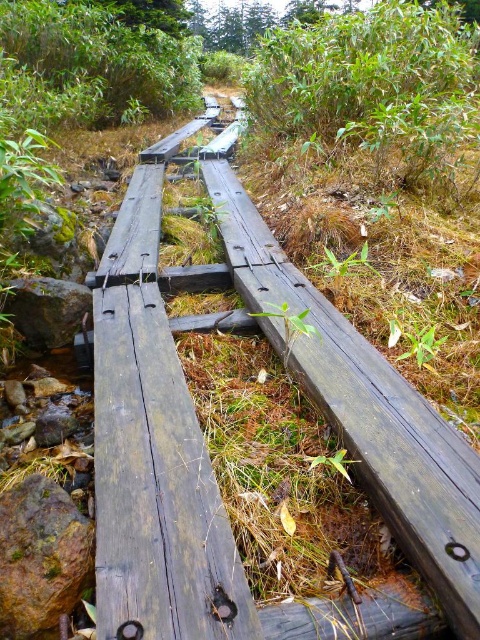
You are standing on the rustic wooden bridge and want to reach both the point at coordinates point (267, 332) and point (56, 484). Which point is closer to you?

Point (56, 484) is closer to you because it is less further to the viewer than point (267, 332).

You are standing on the weathered wood rail at center. You want to move to the stream below. Which direction should you go to reach the stream?

The stream is located below the weathered wood rail at center, so you should move downward to reach it.